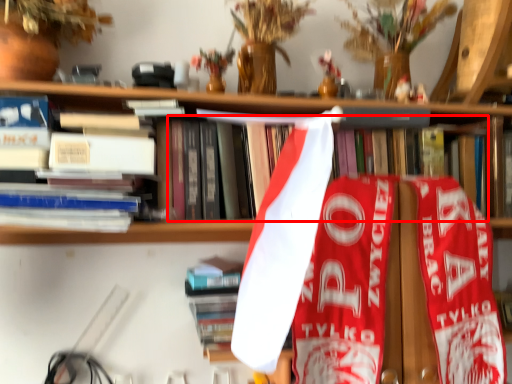
Question: Considering the relative positions of book (annotated by the red box) and book in the image provided, where is book (annotated by the red box) located with respect to the staircase?

Choices:
 (A) right
 (B) left

Answer: (A)